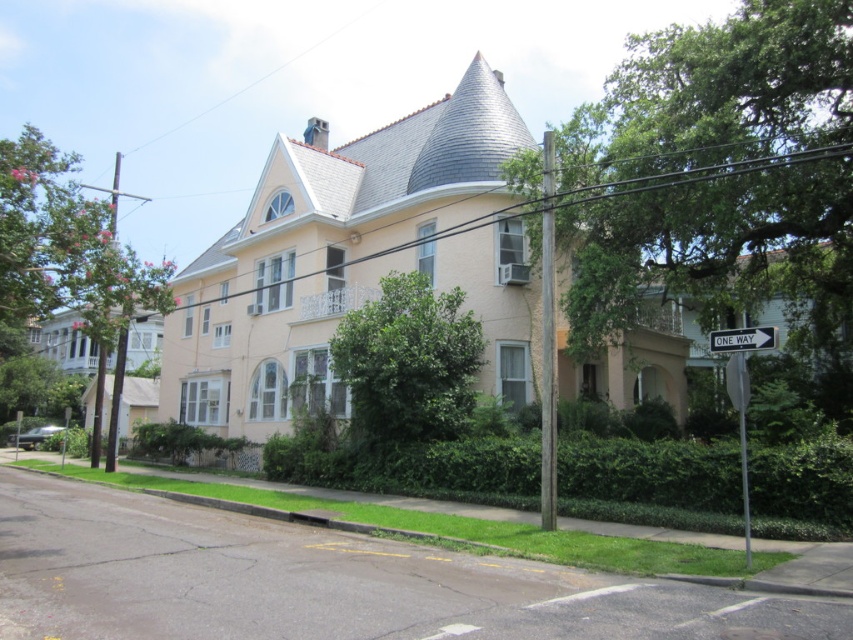
You are standing in front of the house and want to place a small garden statue between the two points marked as point (x=405, y=458) and point (x=412, y=371). Which point should you move towards to position the statue closer to the viewer?

To position the statue closer to the viewer, you should move towards point (x=405, y=458) because it is further to the viewer than point (x=412, y=371).

You are a landscape architect designing a garden. You need to decide which plant to prune first based on their sizes. Which one should you tackle first between the green leafy hedge at lower center and the green leafy tree at center?

The green leafy hedge at lower center is bigger than the green leafy tree at center, so you should prune the green leafy hedge at lower center first.

You are a gardener planning to water the green leafy hedge at lower center and the pink textured tree at left. Based on their positions, which one would you need to move your hose further to the right to reach?

The green leafy hedge at lower center is located below the pink textured tree at left. Since the hedge is positioned lower, it is closer to the right side, so you would need to move your hose further to the right to reach the green leafy hedge at lower center.